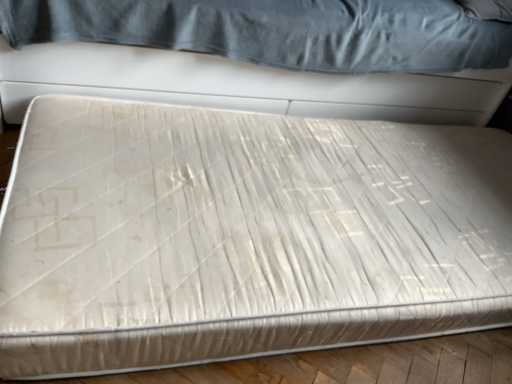
Locate an element on the screen. This screenshot has height=384, width=512. white textured mattress at center is located at coordinates (220, 70).

This screenshot has height=384, width=512. What do you see at coordinates (220, 70) in the screenshot? I see `white textured mattress at center` at bounding box center [220, 70].

This screenshot has width=512, height=384. I want to click on white textured mattress at center, so click(220, 70).